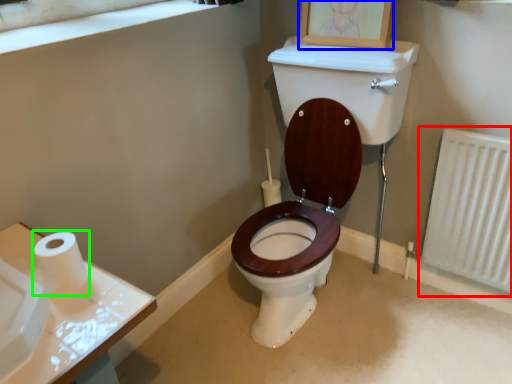
Question: Which object is the closest to the radiator (highlighted by a red box)? Choose among these: picture frame (highlighted by a blue box) or toilet paper (highlighted by a green box).

Choices:
 (A) picture frame
 (B) toilet paper

Answer: (A)